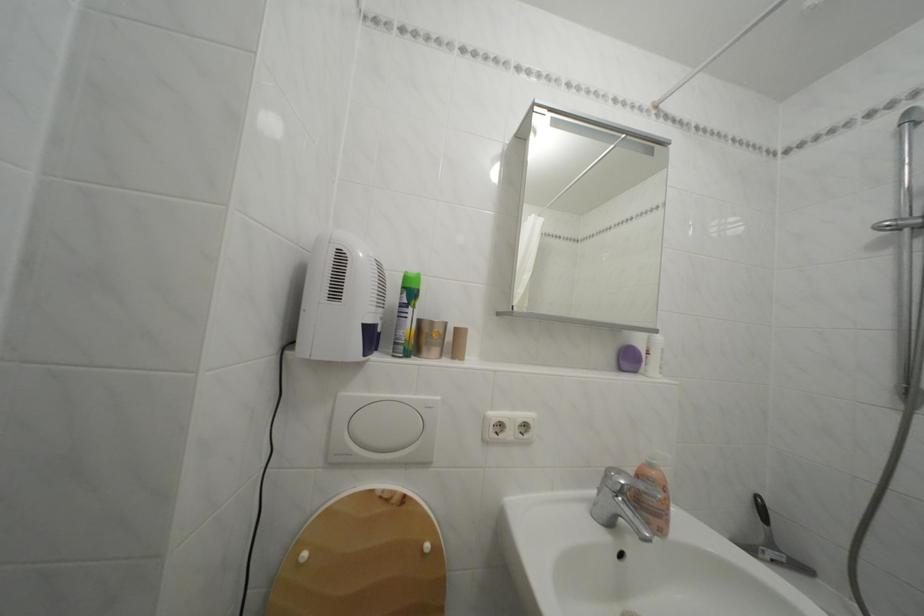
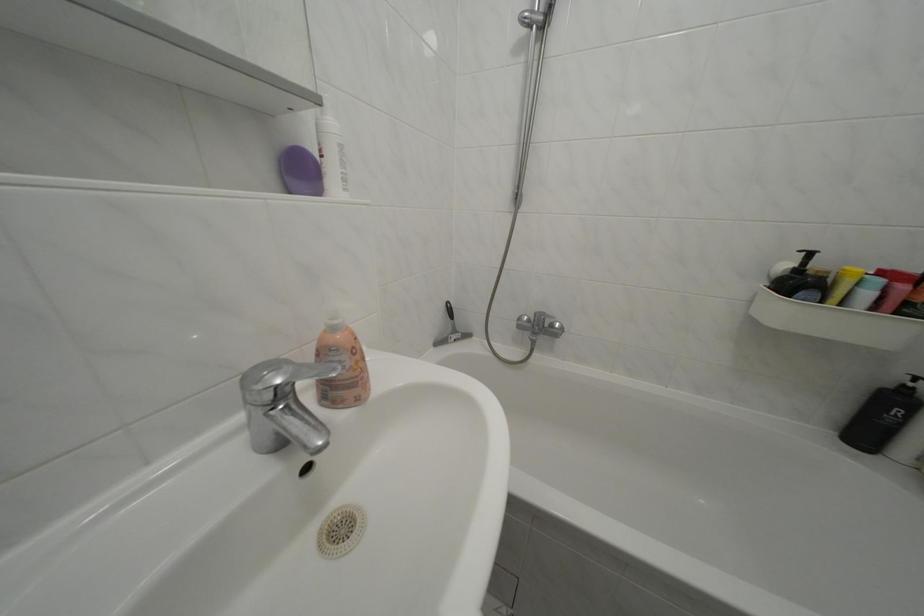
Locate, in the second image, the point that corresponds to (616,477) in the first image.

(252, 384)